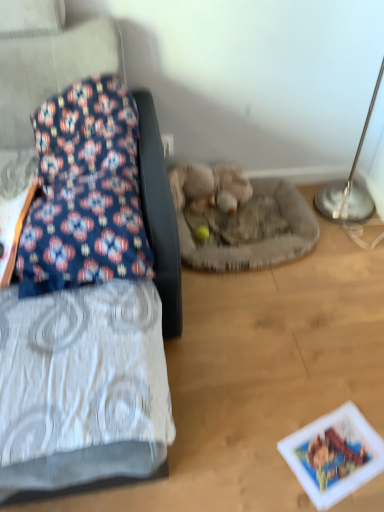
At what (x,y) coordinates should I click in order to perform the action: click on vacant space underneath printed paper postcard at lower right (from a real-world perspective). Please return your answer as a coordinate pair (x, y). This screenshot has width=384, height=512. Looking at the image, I should click on (340, 451).